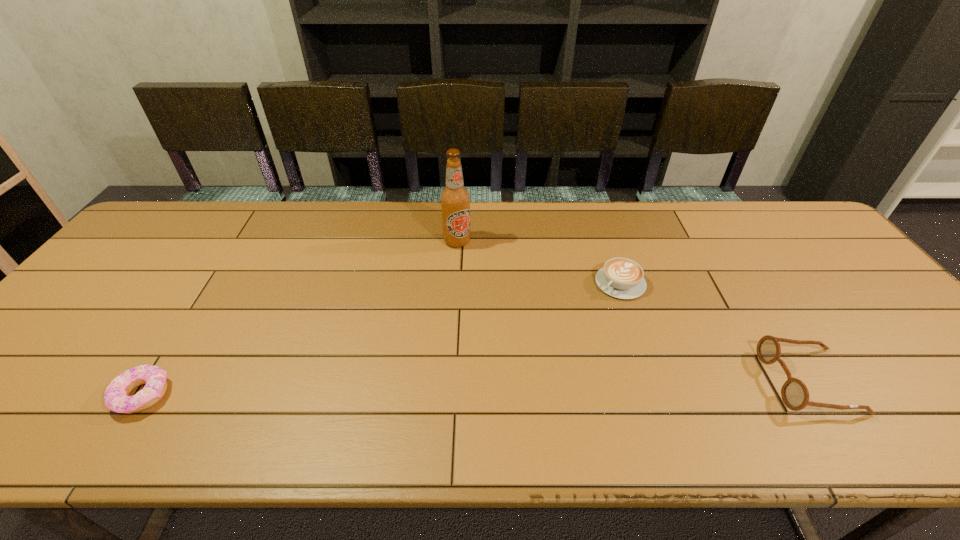
At what (x,y) coordinates should I click in order to perform the action: click on the leftmost object. Please return your answer as a coordinate pair (x, y). The height and width of the screenshot is (540, 960). Looking at the image, I should click on (116, 396).

Identify the location of the second tallest object. Image resolution: width=960 pixels, height=540 pixels. (795, 395).

Locate an element on the screen. The width and height of the screenshot is (960, 540). spectacles is located at coordinates (795, 395).

Locate an element on the screen. the second object from right to left is located at coordinates (x=622, y=278).

At what (x,y) coordinates should I click in order to perform the action: click on the second farthest object. Please return your answer as a coordinate pair (x, y). The height and width of the screenshot is (540, 960). Looking at the image, I should click on (622, 278).

Find the location of a particular element. the tallest object is located at coordinates (455, 199).

I want to click on beer bottle, so click(x=455, y=199).

At what (x,y) coordinates should I click in order to perform the action: click on vacant space positioned 0.050m on the right of the doughnut. Please return your answer as a coordinate pair (x, y). Looking at the image, I should click on click(192, 395).

Locate an element on the screen. The width and height of the screenshot is (960, 540). vacant space located on the front-facing side of the spectacles is located at coordinates (738, 381).

Where is `free space located 0.200m on the front-facing side of the spectacles`? Image resolution: width=960 pixels, height=540 pixels. free space located 0.200m on the front-facing side of the spectacles is located at coordinates (681, 381).